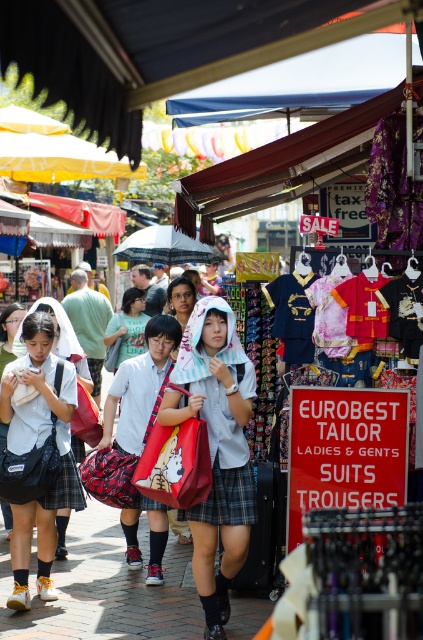
In the market scene, where is the plaid fabric skirt at center located in terms of its 2D coordinates?

The plaid fabric skirt at center is located at the 2D coordinates of point (216, 449).

You are standing in the market and want to move from point A to point B. Point A is at coordinates point (197, 388) and point B is at coordinates point (216, 508). Which point is closer to you?

Point A at coordinates point (197, 388) is closer to you because it is further to the viewer than point B at coordinates point (216, 508).